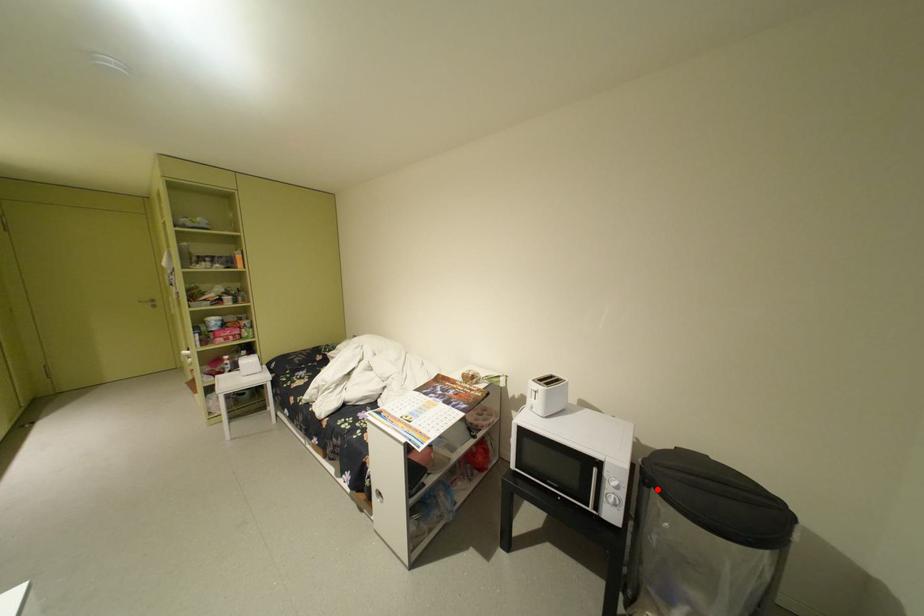
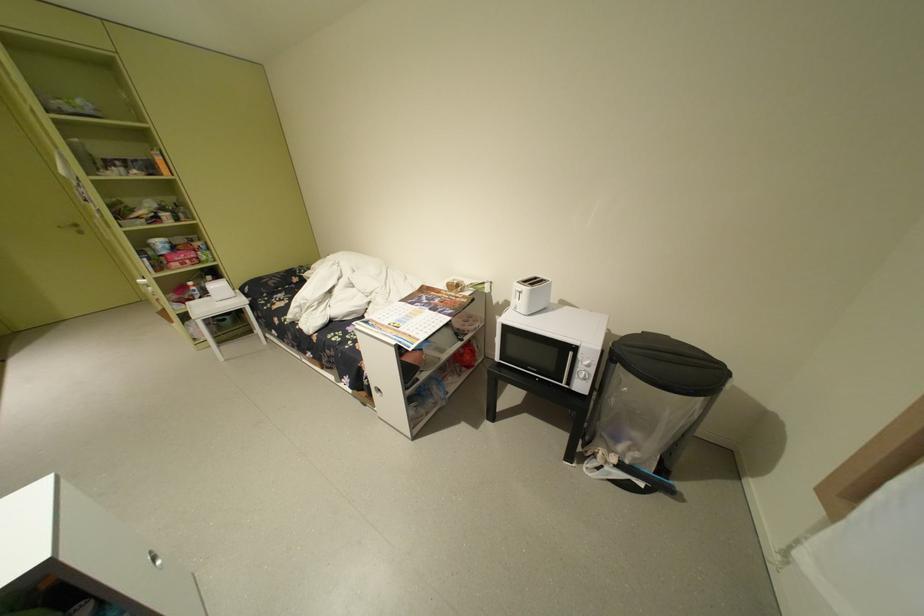
Question: I am providing you with two images of the same scene from different viewpoints. A red point is marked on the first image. Can you still see the location of the red point in image 2?

Choices:
 (A) Yes
 (B) No

Answer: (A)